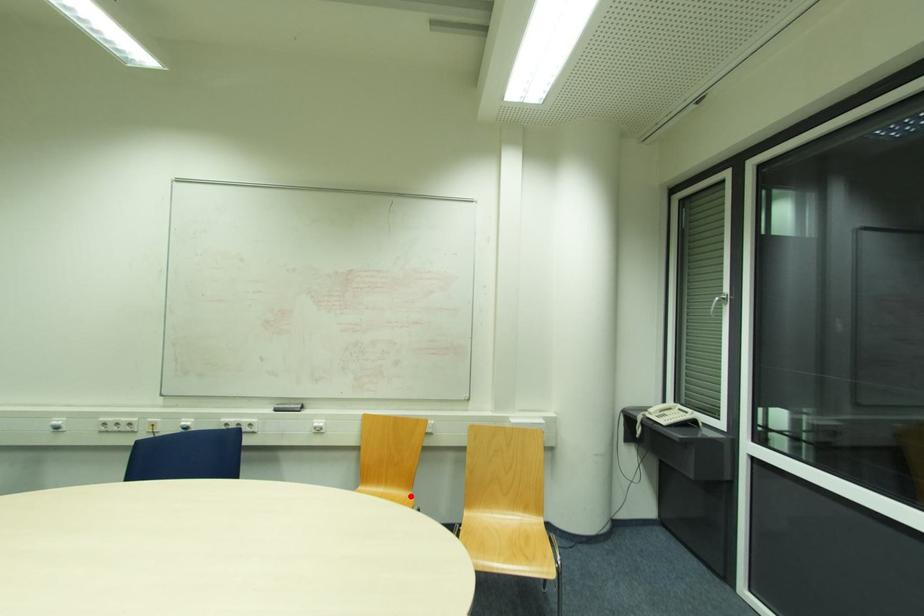
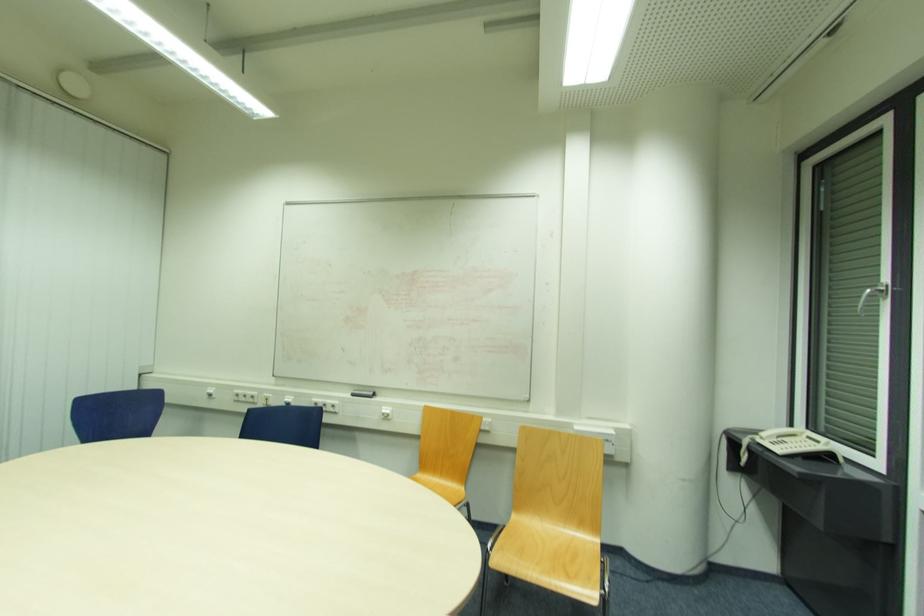
Question: I am providing you with two images of the same scene from different viewpoints. Given a red point in image1, look at the same physical point in image2. Is it:

Choices:
 (A) Closer to the viewpoint
 (B) Farther from the viewpoint

Answer: (A)